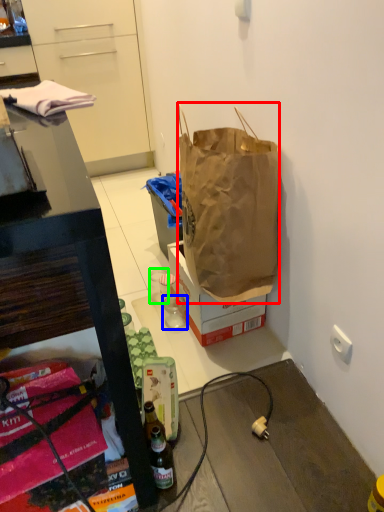
Question: Which object is positioned farthest from handbag (highlighted by a red box)? Select from coffee cup (highlighted by a blue box) and coffee cup (highlighted by a green box).

Choices:
 (A) coffee cup
 (B) coffee cup

Answer: (B)